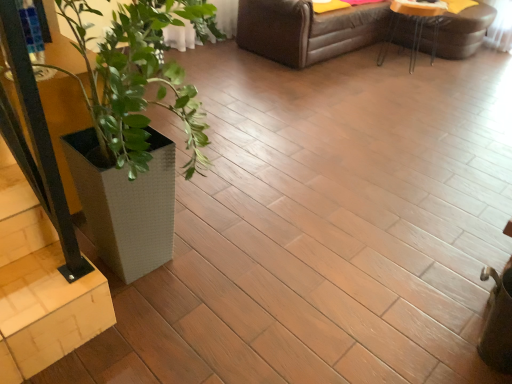
Question: Is white textured planter at lower left bigger than wooden table at upper right?

Choices:
 (A) yes
 (B) no

Answer: (B)

Question: Is white textured planter at lower left taller than wooden table at upper right?

Choices:
 (A) no
 (B) yes

Answer: (B)

Question: Would you say white textured planter at lower left is outside wooden table at upper right?

Choices:
 (A) no
 (B) yes

Answer: (B)

Question: Does white textured planter at lower left turn towards wooden table at upper right?

Choices:
 (A) yes
 (B) no

Answer: (A)

Question: Does white textured planter at lower left have a lesser height compared to wooden table at upper right?

Choices:
 (A) no
 (B) yes

Answer: (A)

Question: From a real-world perspective, is white textured planter at lower left physically above wooden table at upper right?

Choices:
 (A) yes
 (B) no

Answer: (A)

Question: Considering the relative sizes of white textured planter at left and wooden table at upper right in the image provided, is white textured planter at left smaller than wooden table at upper right?

Choices:
 (A) no
 (B) yes

Answer: (A)

Question: Considering the relative sizes of white textured planter at left and wooden table at upper right in the image provided, is white textured planter at left shorter than wooden table at upper right?

Choices:
 (A) yes
 (B) no

Answer: (B)

Question: Would you say white textured planter at left is a long distance from wooden table at upper right?

Choices:
 (A) yes
 (B) no

Answer: (A)

Question: Is white textured planter at left further to camera compared to wooden table at upper right?

Choices:
 (A) no
 (B) yes

Answer: (A)

Question: Is the depth of white textured planter at left less than that of wooden table at upper right?

Choices:
 (A) yes
 (B) no

Answer: (A)

Question: Is wooden table at upper right a part of white textured planter at left?

Choices:
 (A) no
 (B) yes

Answer: (A)

Question: Does white textured planter at left come behind white textured planter at lower left?

Choices:
 (A) yes
 (B) no

Answer: (B)